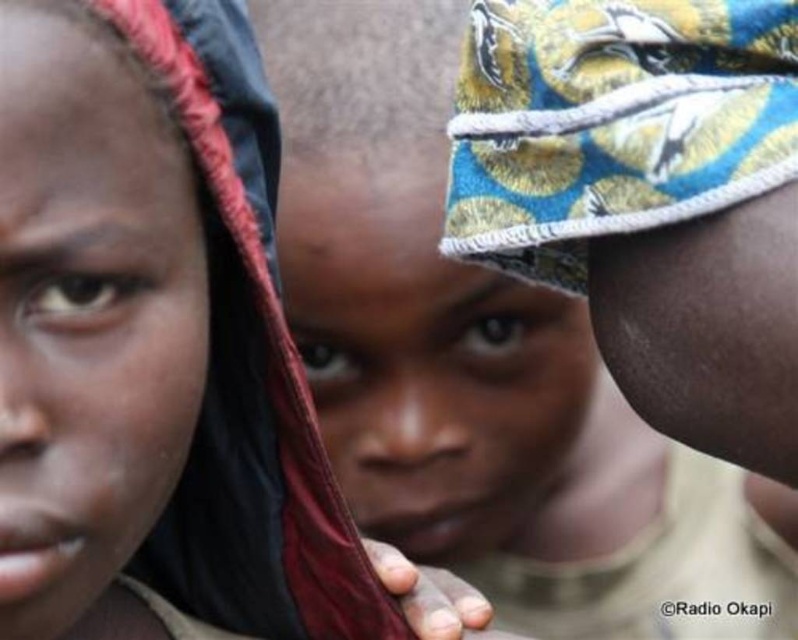
Is matte fabric headscarf at center below matte black headscarf at left?

Actually, matte fabric headscarf at center is above matte black headscarf at left.

Between point (444, 422) and point (253, 145), which one is positioned in front?

Positioned in front is point (253, 145).

Image resolution: width=798 pixels, height=640 pixels. What do you see at coordinates (480, 369) in the screenshot? I see `matte fabric headscarf at center` at bounding box center [480, 369].

The width and height of the screenshot is (798, 640). What are the coordinates of `matte fabric headscarf at center` in the screenshot? It's located at (480, 369).